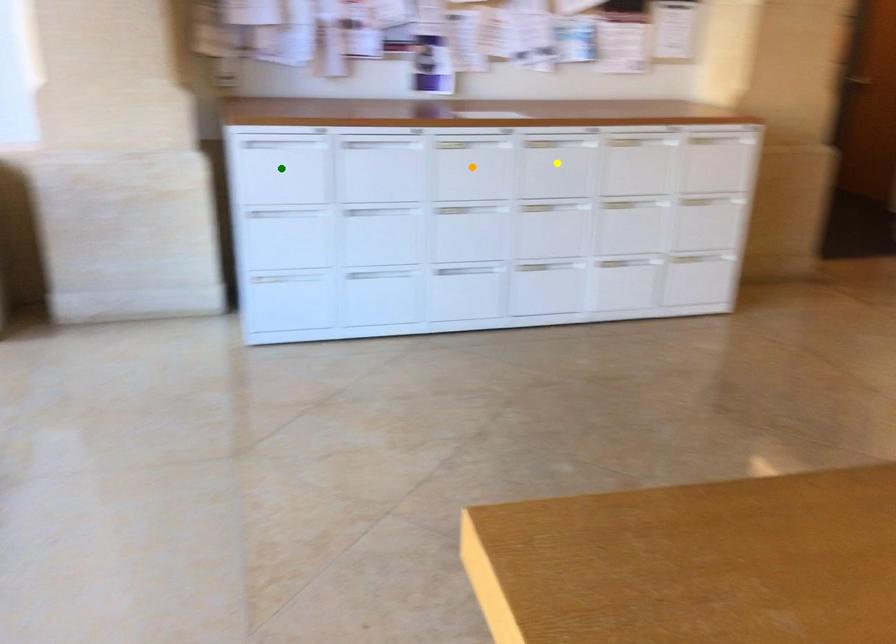
Order these from nearest to farthest:
green point | orange point | yellow point

green point → orange point → yellow point